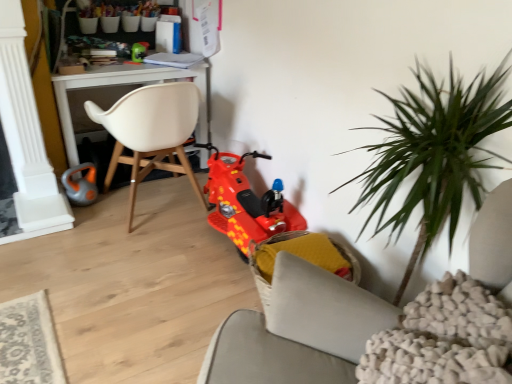
This screenshot has width=512, height=384. Identify the location of empty space that is ontop of white plastic desk at upper left (from a real-world perspective). (137, 61).